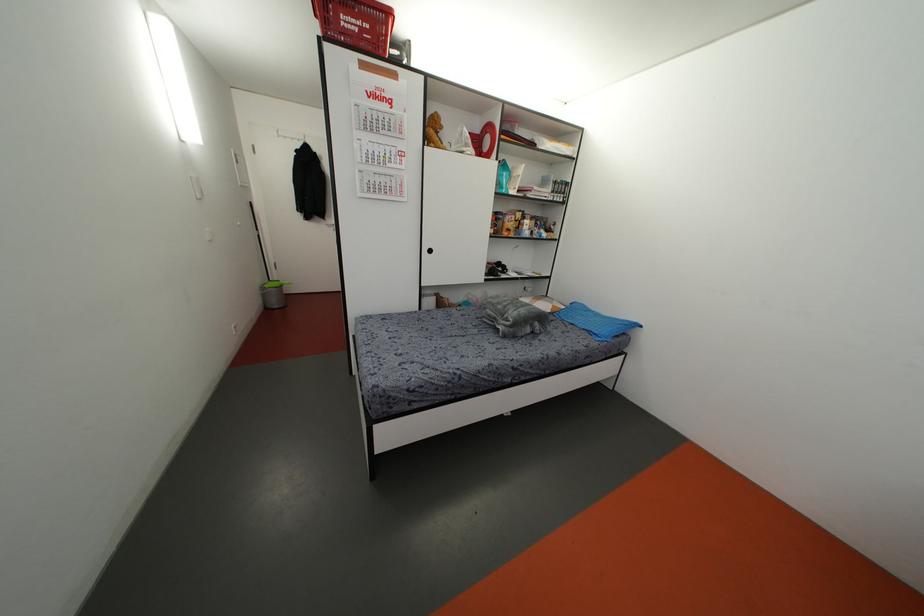
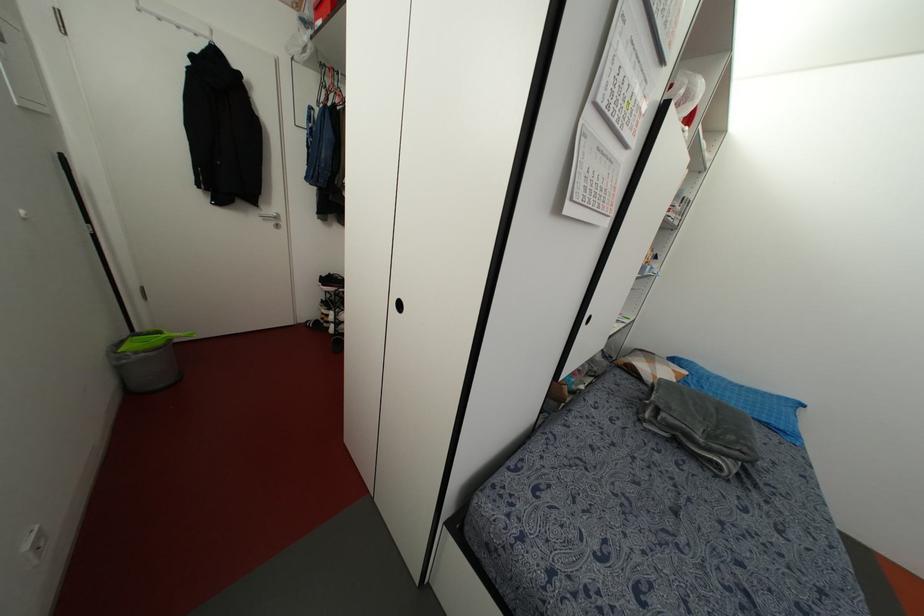
Find the pixel in the second image that matches [596,331] in the first image.

(782, 427)